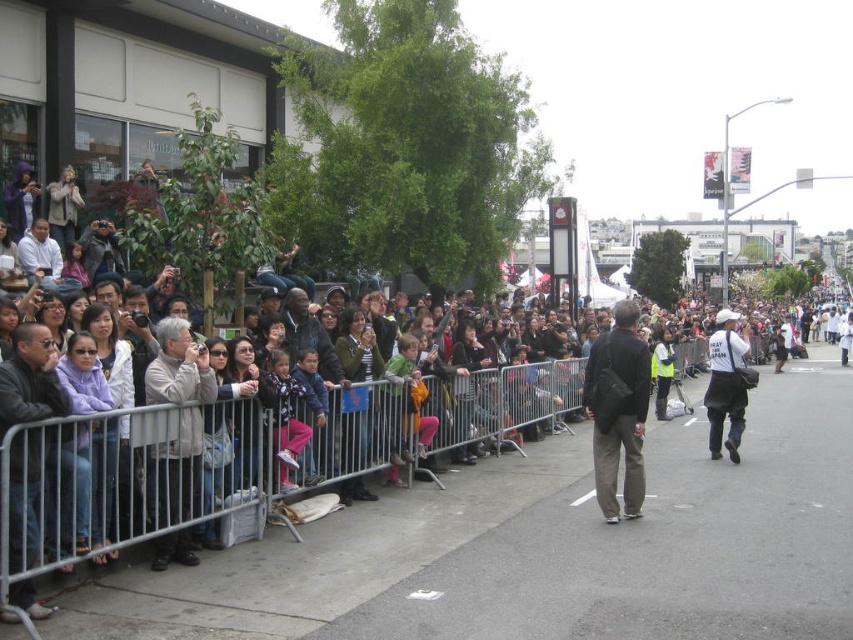
You are a photographer standing on the gray asphalt pavement at center. You want to take a photo of the dark gray jacket at left. Which direction should you move to get a better angle?

You should move to the right of the dark gray jacket at left because the gray asphalt pavement at center is to the right of it, providing a better angle.

You are standing at the point labeled point [181,384] in the image. You want to take a photo of the crowd behind the barricades using your camera. Is the camera within your reach?

The distance between point [181,384] and the camera is 22.68 feet, which is too far to reach. You need to move closer to the camera to take the photo.

You are a photographer trying to capture both the dark gray fabric jacket at center and the white matte vest at center in the same frame. Which of these two items should you focus on first to ensure both are in the frame?

The dark gray fabric jacket at center is smaller than the white matte vest at center, so you should focus on the white matte vest at center first to ensure both are in the frame.